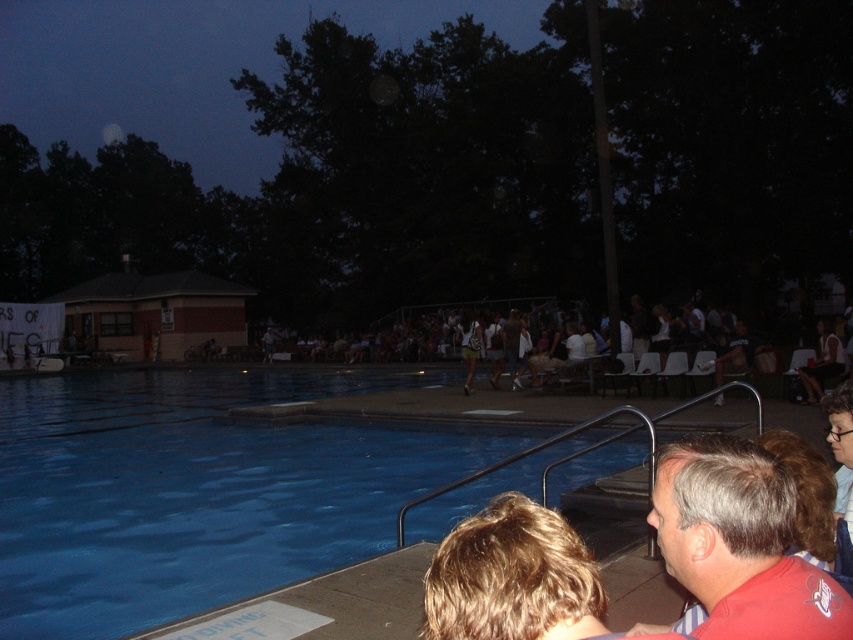
You are standing at the edge of the pool and want to walk to the blue smooth water at lower left. Which direction should you go from the dark blue pool at center?

You should walk to the left from the dark blue pool at center to reach the blue smooth water at lower left because the dark blue pool at center is to the left of blue smooth water at lower left.

You are a lifeguard standing at the edge of the dark blue pool at center and want to jump into the blue smooth water at lower left. Based on the scene, will you land safely? Explain why.

The dark blue pool at center has a greater height compared to the blue smooth water at lower left. Since the blue smooth water at lower left is lower in elevation, jumping from the higher dark blue pool at center could result in a safe landing as long as the depth of the water is sufficient. However, the scene description does not provide information about the water depth, so caution is advised.

You are standing at the edge of the dark blue pool at center and want to greet the person wearing the red matte shirt at lower right. In which direction should you walk to reach them?

The dark blue pool at center is to the left of the red matte shirt at lower right, so you should walk to your right to reach them.